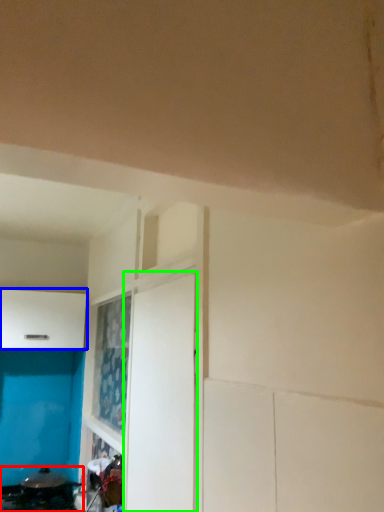
Question: Considering the real-world distances, which object is farthest from appliance (highlighted by a red box)? cabinetry (highlighted by a blue box) or door (highlighted by a green box)?

Choices:
 (A) cabinetry
 (B) door

Answer: (B)